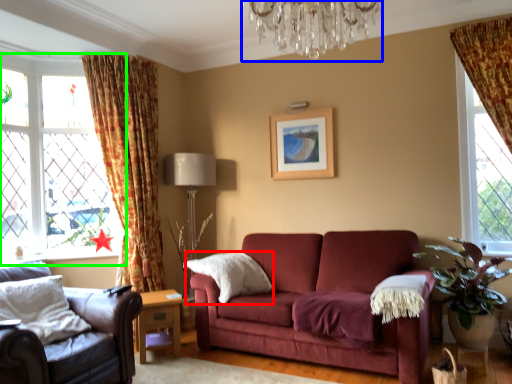
Question: Which is farther away from pillow (highlighted by a red box)? light fixture (highlighted by a blue box) or window (highlighted by a green box)?

Choices:
 (A) light fixture
 (B) window

Answer: (A)